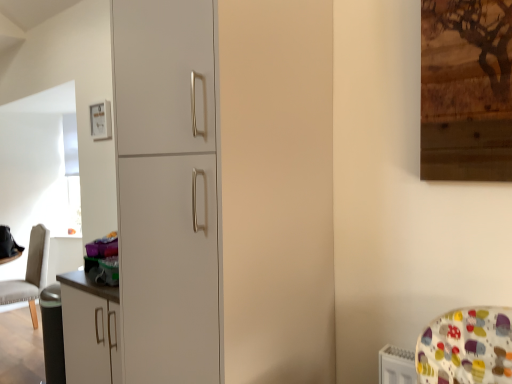
Question: Is the position of white matte cabinet at center less distant than that of leather-like beige chair at left?

Choices:
 (A) yes
 (B) no

Answer: (A)

Question: From the image's perspective, is white matte cabinet at center under leather-like beige chair at left?

Choices:
 (A) yes
 (B) no

Answer: (B)

Question: Can you confirm if white matte cabinet at center is thinner than leather-like beige chair at left?

Choices:
 (A) no
 (B) yes

Answer: (A)

Question: Does white matte cabinet at center touch leather-like beige chair at left?

Choices:
 (A) no
 (B) yes

Answer: (A)

Question: Does white matte cabinet at center come behind leather-like beige chair at left?

Choices:
 (A) no
 (B) yes

Answer: (A)

Question: Is matte white picture frame at upper left to the left or to the right of white matte cabinet at center in the image?

Choices:
 (A) left
 (B) right

Answer: (A)

Question: Is matte white picture frame at upper left taller or shorter than white matte cabinet at center?

Choices:
 (A) tall
 (B) short

Answer: (B)

Question: Is matte white picture frame at upper left inside or outside of white matte cabinet at center?

Choices:
 (A) inside
 (B) outside

Answer: (B)

Question: Is matte white picture frame at upper left wider or thinner than white matte cabinet at center?

Choices:
 (A) wide
 (B) thin

Answer: (B)

Question: From their relative heights in the image, would you say matte white picture frame at upper left is taller or shorter than leather-like beige chair at left?

Choices:
 (A) tall
 (B) short

Answer: (B)

Question: In terms of size, does matte white picture frame at upper left appear bigger or smaller than leather-like beige chair at left?

Choices:
 (A) big
 (B) small

Answer: (B)

Question: From a real-world perspective, is matte white picture frame at upper left above or below leather-like beige chair at left?

Choices:
 (A) below
 (B) above

Answer: (B)

Question: In the image, is matte white picture frame at upper left positioned in front of or behind leather-like beige chair at left?

Choices:
 (A) front
 (B) behind

Answer: (A)

Question: Considering the positions of white matte cabinet at center and matte white picture frame at upper left in the image, is white matte cabinet at center wider or thinner than matte white picture frame at upper left?

Choices:
 (A) wide
 (B) thin

Answer: (A)

Question: From the image's perspective, relative to matte white picture frame at upper left, is white matte cabinet at center above or below?

Choices:
 (A) below
 (B) above

Answer: (A)